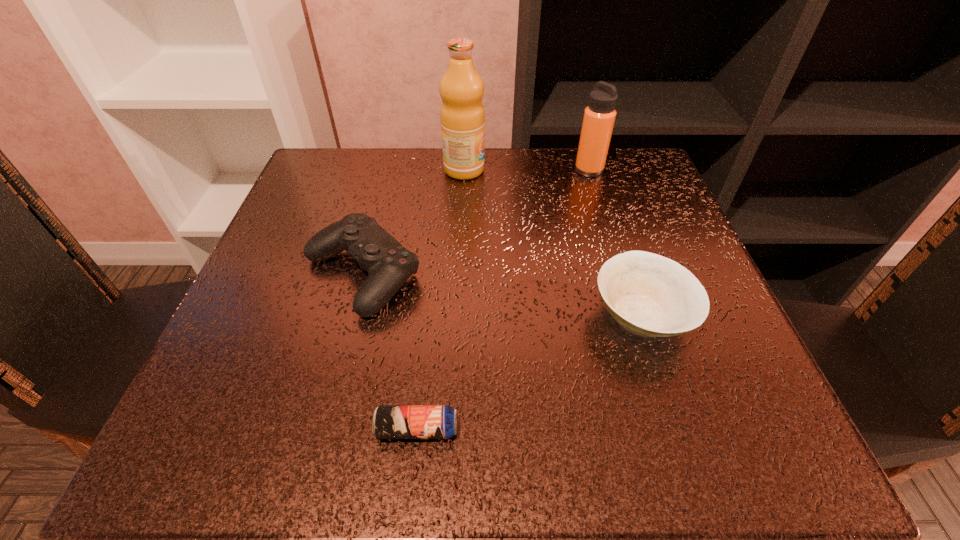
Identify the location of fruit juice. (462, 116).

Identify the location of thermos bottle. (599, 117).

At what (x,y) coordinates should I click in order to perform the action: click on control. Please return your answer as a coordinate pair (x, y). Looking at the image, I should click on (389, 264).

The width and height of the screenshot is (960, 540). What are the coordinates of `bowl` in the screenshot? It's located at (648, 294).

Locate an element on the screen. the shortest object is located at coordinates (389, 421).

You are a GUI agent. You are given a task and a screenshot of the screen. Output one action in this format:
    pyautogui.click(x=<x>, y=<y>)
    Task: Click on the nearest object
    The width and height of the screenshot is (960, 540).
    Given the screenshot: What is the action you would take?
    pyautogui.click(x=389, y=421)

You are a GUI agent. You are given a task and a screenshot of the screen. Output one action in this format:
    pyautogui.click(x=<x>, y=<y>)
    Task: Click on the blank space located 0.310m on the front label of the tallest object
    This screenshot has width=960, height=540.
    Given the screenshot: What is the action you would take?
    pyautogui.click(x=622, y=170)

Find the location of a particular element. free space located 0.300m on the front of the thermos bottle is located at coordinates (622, 276).

Find the location of `vacant space located 0.160m on the back of the control`. vacant space located 0.160m on the back of the control is located at coordinates [385, 186].

Locate an element on the screen. This screenshot has width=960, height=540. free location located 0.150m on the front of the bowl is located at coordinates (690, 464).